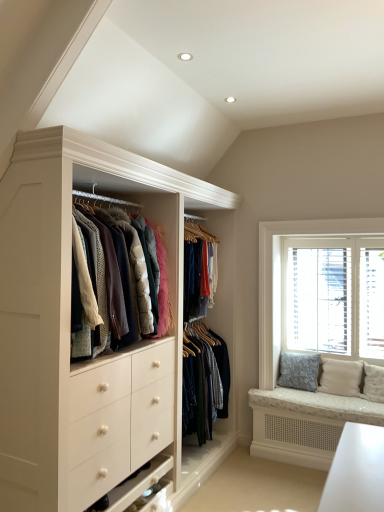
Question: Relative to white wooden window at right, is textured beige pillow at right, which is counted as the second pillow, starting from the left, in front or behind?

Choices:
 (A) front
 (B) behind

Answer: (A)

Question: In terms of height, does textured beige pillow at right, positioned as the 1th pillow in right-to-left order, look taller or shorter compared to white wooden window at right?

Choices:
 (A) short
 (B) tall

Answer: (A)

Question: Estimate the real-world distances between objects in this image. Which object is closer to the blue floral cushion at right, acting as the 2th pillow starting from the right?

Choices:
 (A) white wooden window at right
 (B) textured beige pillow at right, which is counted as the second pillow, starting from the left

Answer: (B)

Question: Which object is the farthest from the textured beige pillow at right, positioned as the 1th pillow in right-to-left order?

Choices:
 (A) blue floral cushion at right, which is the 1th pillow from left to right
 (B) white wooden window at right

Answer: (B)